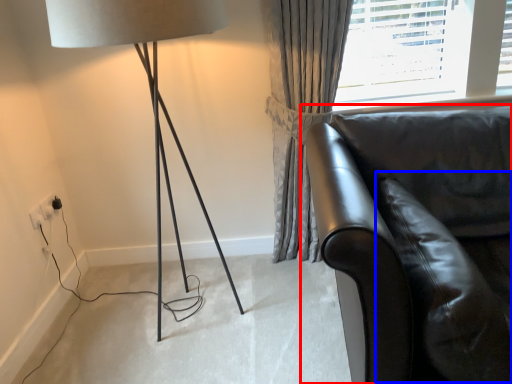
Question: Among these objects, which one is nearest to the camera, studio couch (highlighted by a red box) or swivel chair (highlighted by a blue box)?

Choices:
 (A) studio couch
 (B) swivel chair

Answer: (A)